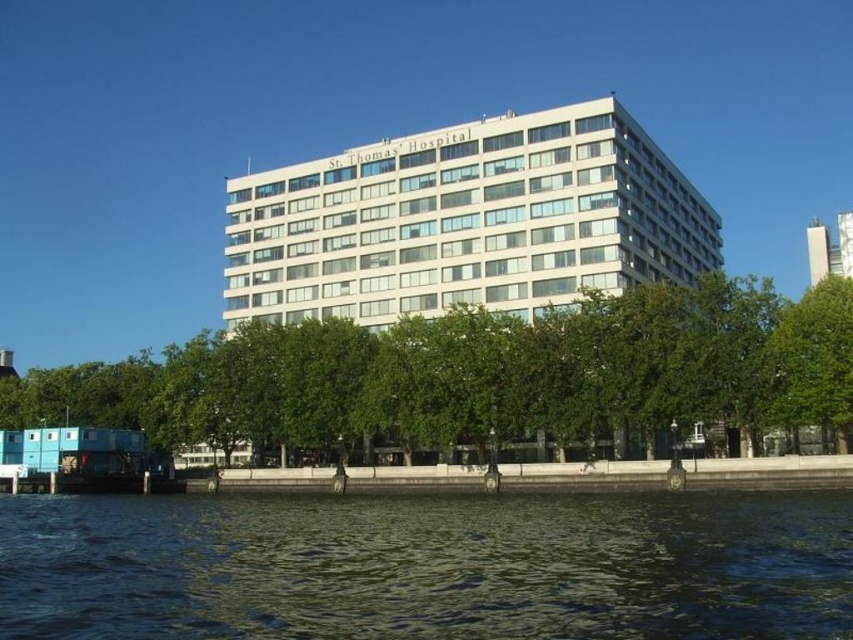
Question: Is dark blue water at lower center in front of green leafy tree at center?

Choices:
 (A) no
 (B) yes

Answer: (B)

Question: Which of the following is the closest to the observer?

Choices:
 (A) green leafy tree at center
 (B) dark blue water at lower center

Answer: (B)

Question: Which object is farther from the camera taking this photo?

Choices:
 (A) green leafy tree at center
 (B) white smooth building at center
 (C) dark blue water at lower center

Answer: (B)

Question: Can you confirm if green leafy tree at center is positioned above white smooth building at center?

Choices:
 (A) yes
 (B) no

Answer: (B)

Question: Which object is positioned closest to the dark blue water at lower center?

Choices:
 (A) white smooth building at center
 (B) green leafy tree at center

Answer: (B)

Question: Does dark blue water at lower center have a smaller size compared to white smooth building at center?

Choices:
 (A) yes
 (B) no

Answer: (A)